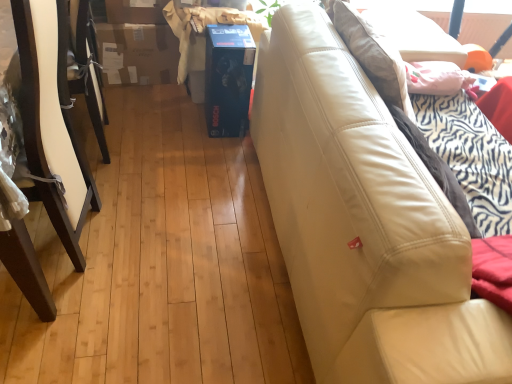
Question: Should I look upward or downward to see beige leather couch at right?

Choices:
 (A) down
 (B) up

Answer: (B)

Question: Is white painted wood chair at left aimed at beige leather couch at right?

Choices:
 (A) no
 (B) yes

Answer: (A)

Question: Considering the relative positions of white painted wood chair at left and beige leather couch at right in the image provided, is white painted wood chair at left to the left of beige leather couch at right from the viewer's perspective?

Choices:
 (A) no
 (B) yes

Answer: (B)

Question: Is beige leather couch at right surrounded by white painted wood chair at left?

Choices:
 (A) no
 (B) yes

Answer: (A)

Question: From a real-world perspective, is white painted wood chair at left beneath beige leather couch at right?

Choices:
 (A) yes
 (B) no

Answer: (B)

Question: Is beige leather couch at right at the back of white painted wood chair at left?

Choices:
 (A) no
 (B) yes

Answer: (A)

Question: From the image's perspective, is white painted wood chair at left on top of beige leather couch at right?

Choices:
 (A) no
 (B) yes

Answer: (B)

Question: Is beige leather couch at right facing towards white painted wood chair at left?

Choices:
 (A) yes
 (B) no

Answer: (B)

Question: Would you consider beige leather couch at right to be distant from white painted wood chair at left?

Choices:
 (A) yes
 (B) no

Answer: (B)

Question: Is beige leather couch at right wider than white painted wood chair at left?

Choices:
 (A) yes
 (B) no

Answer: (B)

Question: Is white painted wood chair at left completely or partially inside beige leather couch at right?

Choices:
 (A) no
 (B) yes

Answer: (A)

Question: Is beige leather couch at right oriented away from white painted wood chair at left?

Choices:
 (A) yes
 (B) no

Answer: (A)

Question: Is beige leather couch at right thinner than white painted wood chair at left?

Choices:
 (A) yes
 (B) no

Answer: (A)

Question: Is beige leather couch at right wider or thinner than white painted wood chair at left?

Choices:
 (A) thin
 (B) wide

Answer: (A)